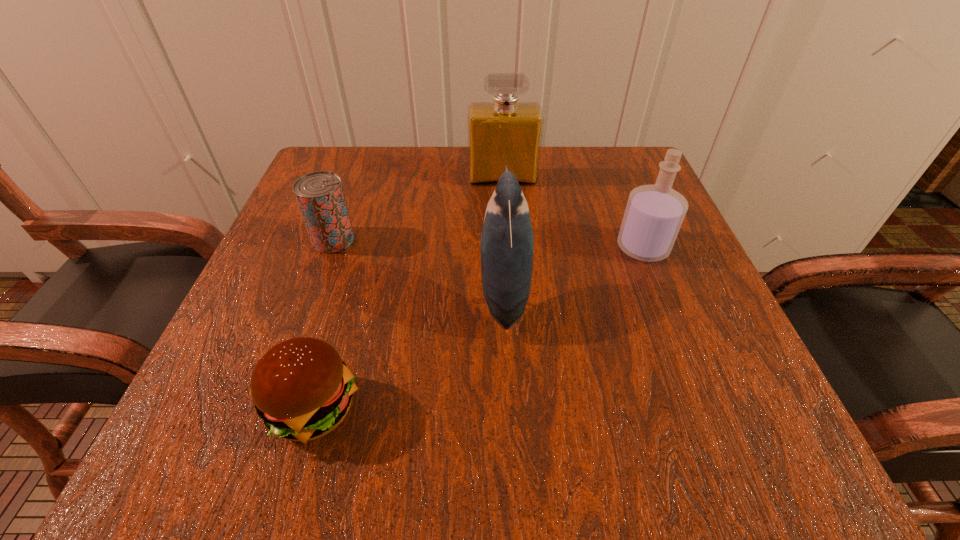
At what (x,y) coordinates should I click in order to perform the action: click on free space located 0.160m at the tip of the bird's beak. Please return your answer as a coordinate pair (x, y). The width and height of the screenshot is (960, 540). Looking at the image, I should click on (384, 295).

Image resolution: width=960 pixels, height=540 pixels. Find the location of `vacant area situated 0.240m on the left of the nearer perfume`. vacant area situated 0.240m on the left of the nearer perfume is located at coordinates (487, 248).

Identify the location of free space located 0.350m on the front of the beer can. (261, 440).

Identify the location of vacant space located on the right of the nearest object. The image size is (960, 540). (654, 409).

Where is `object present at the far edge`? object present at the far edge is located at coordinates (505, 132).

Image resolution: width=960 pixels, height=540 pixels. What are the coordinates of `object at the near edge` in the screenshot? It's located at (302, 389).

Find the location of a particular element. beer can that is at the left edge is located at coordinates (320, 195).

The image size is (960, 540). Identify the location of hamburger present at the left edge. (302, 389).

Find the location of a particular element. Image resolution: width=960 pixels, height=540 pixels. object present at the right edge is located at coordinates (654, 214).

Find the location of a particular element. Image resolution: width=960 pixels, height=540 pixels. object that is at the near left corner is located at coordinates (302, 389).